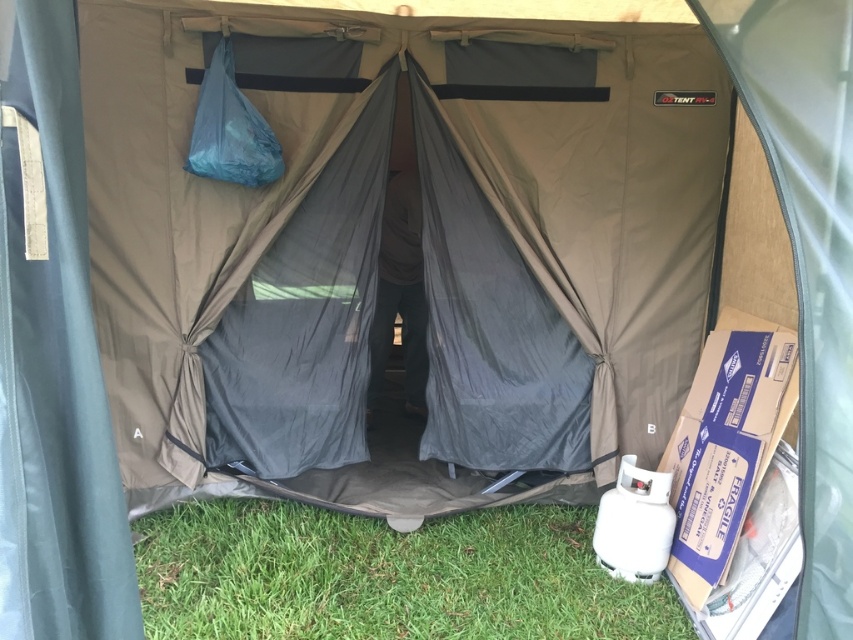
Which is in front, point (306, 625) or point (192, 140)?

Point (306, 625) is in front.

Is green grass at lower left to the left of blue fabric sleeping bag at upper center from the viewer's perspective?

Incorrect, green grass at lower left is not on the left side of blue fabric sleeping bag at upper center.

The image size is (853, 640). What are the coordinates of `green grass at lower left` in the screenshot? It's located at (386, 577).